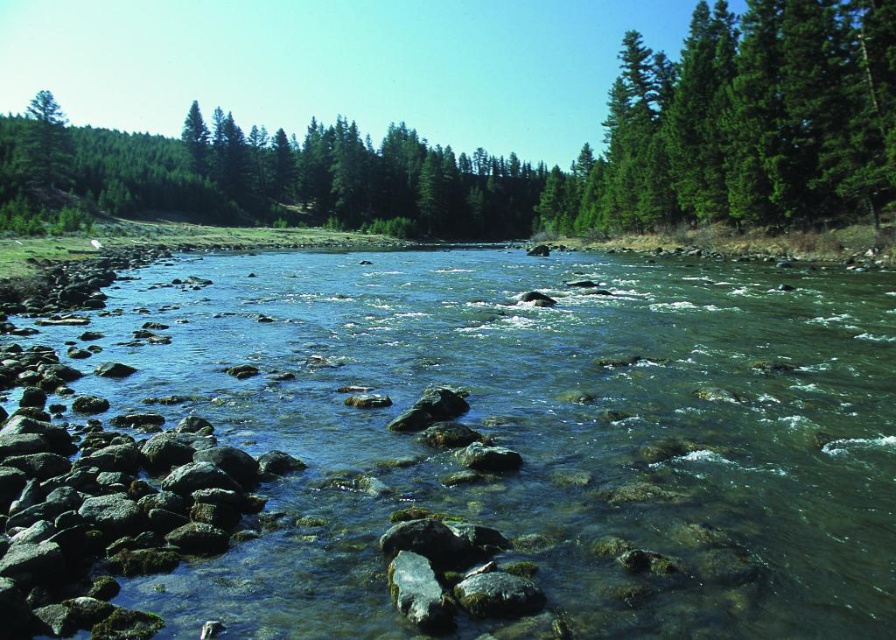
Question: Can you confirm if clear water at center is positioned to the right of green textured tree at upper right?

Choices:
 (A) yes
 (B) no

Answer: (B)

Question: Which point is closer to the camera taking this photo?

Choices:
 (A) (737, 474)
 (B) (571, 195)

Answer: (A)

Question: Can you confirm if green textured tree at upper right is thinner than green matte tree at upper left?

Choices:
 (A) no
 (B) yes

Answer: (B)

Question: Which point is closer to the camera?

Choices:
 (A) (289, 337)
 (B) (39, 177)

Answer: (A)

Question: From the image, what is the correct spatial relationship of green textured tree at upper right in relation to green matte tree at upper left?

Choices:
 (A) above
 (B) below

Answer: (B)

Question: Estimate the real-world distances between objects in this image. Which object is farther from the green matte tree at upper left?

Choices:
 (A) green textured tree at upper right
 (B) clear water at center

Answer: (B)